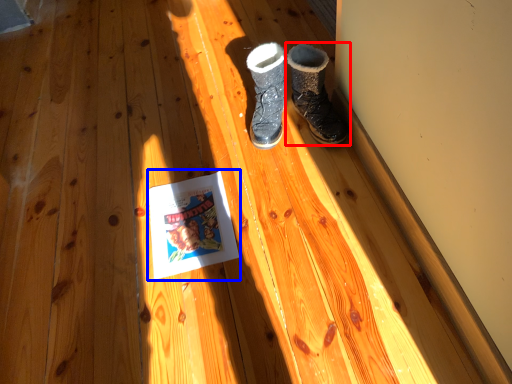
Question: Which object is further to the camera taking this photo, footwear (highlighted by a red box) or paperback book (highlighted by a blue box)?

Choices:
 (A) footwear
 (B) paperback book

Answer: (A)